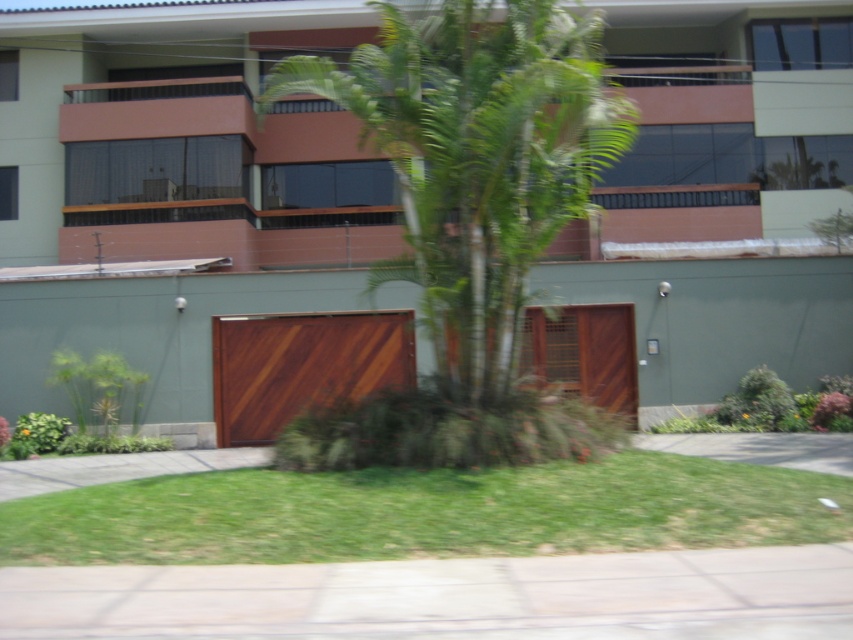
You are standing at the point marked as point (426, 513) in the image. What is the color of the ground beneath your feet?

The point (426, 513) is on green grass at lower center, so the ground beneath your feet is green grass.

Looking at this image, you are a gardener who needs to water the green leafy palm tree at center and the concrete at lower center. Since the palm tree requires more water, which object should you prioritize watering first?

The green leafy palm tree at center requires more water since it is larger in size than the concrete at lower center.